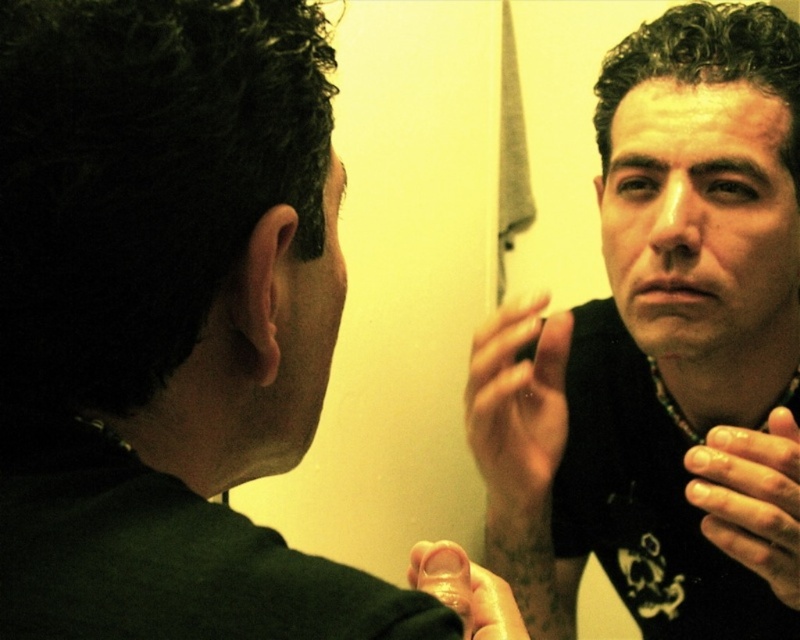
You are a photographer adjusting the focus of your camera. You want to capture a clear image of the smooth skin hand at center in the mirror. Given that the camera and the hand are 47.80 centimeters apart, what is the minimum focusing distance your camera lens needs to have to ensure the hand is in focus?

The camera and the smooth skin hand at center are 47.80 centimeters apart. Therefore, the camera lens must have a minimum focusing distance of at least 47.80 centimeters to capture the hand clearly.

You are a makeup artist preparing to apply eyeliner. You see the smooth skin hand at center and the smooth skin finger at center in the mirror. Which object is positioned to the right side?

The smooth skin hand at center is positioned to the right of the smooth skin finger at center according to the mirror reflection.